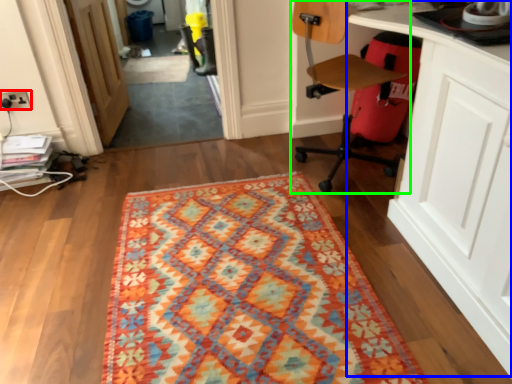
Question: Which is farther away from electric outlet (highlighted by a red box)? computer desk (highlighted by a blue box) or chair (highlighted by a green box)?

Choices:
 (A) computer desk
 (B) chair

Answer: (A)